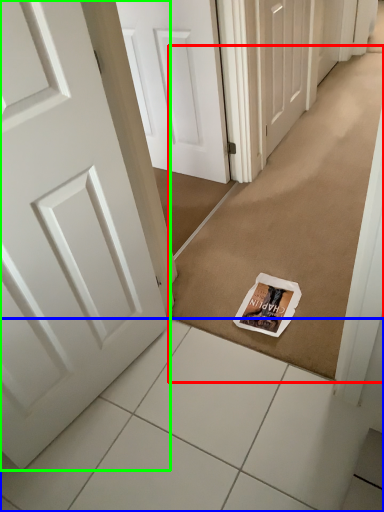
Question: Which is farther away from doormat (highlighted by a red box)? tile (highlighted by a blue box) or door (highlighted by a green box)?

Choices:
 (A) tile
 (B) door

Answer: (B)